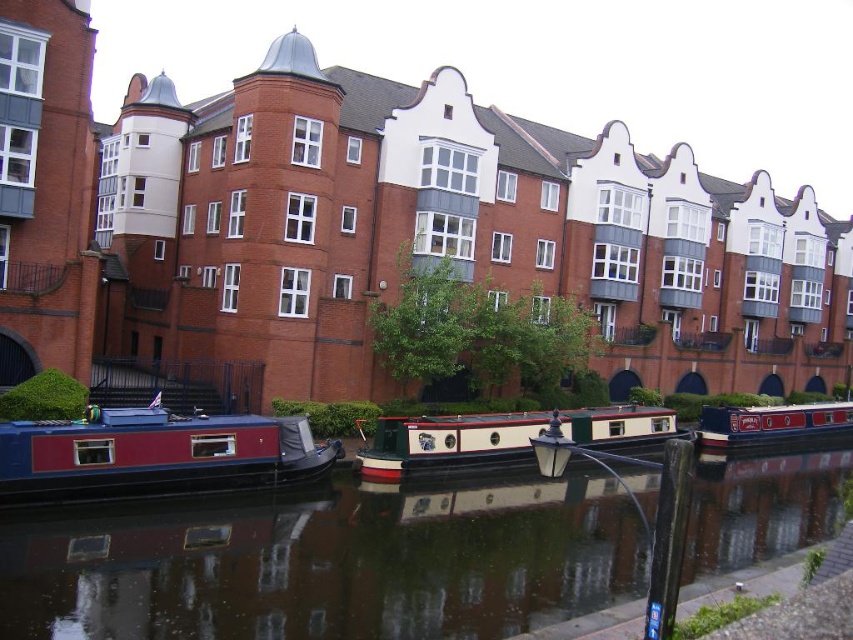
Is smooth dark water at center smaller than blue polished wood boat at center?

No.

Image resolution: width=853 pixels, height=640 pixels. Identify the location of smooth dark water at center. (328, 564).

Which is below, matte blue boat at lower left or blue polished wood boat at center?

Positioned lower is blue polished wood boat at center.

Which of these two, matte blue boat at lower left or blue polished wood boat at center, stands taller?

Standing taller between the two is matte blue boat at lower left.

Is point (283, 470) more distant than point (784, 404)?

That is False.

Identify the location of matte blue boat at lower left. (155, 456).

Does point (291, 525) lie in front of point (433, 420)?

Yes.

Is point (706, 566) positioned before point (386, 456)?

That is True.

This screenshot has height=640, width=853. Find the location of `smooth dark water at center`. smooth dark water at center is located at coordinates (328, 564).